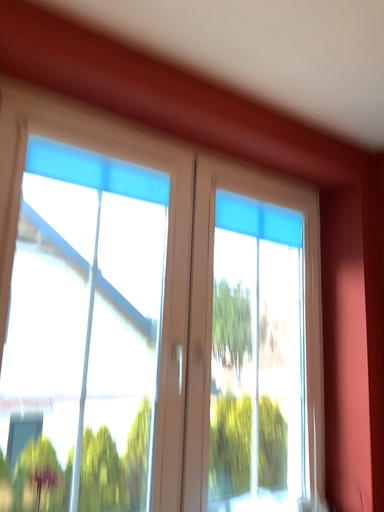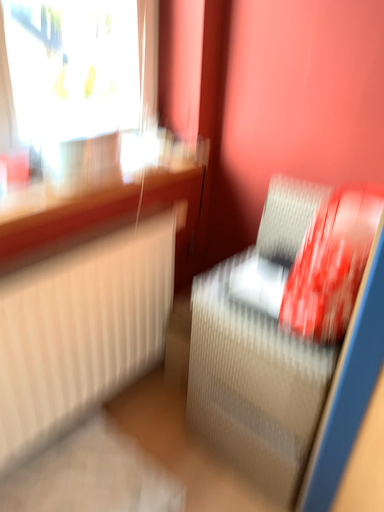
Question: Which way did the camera rotate in the video?

Choices:
 (A) rotated upward
 (B) rotated downward

Answer: (B)